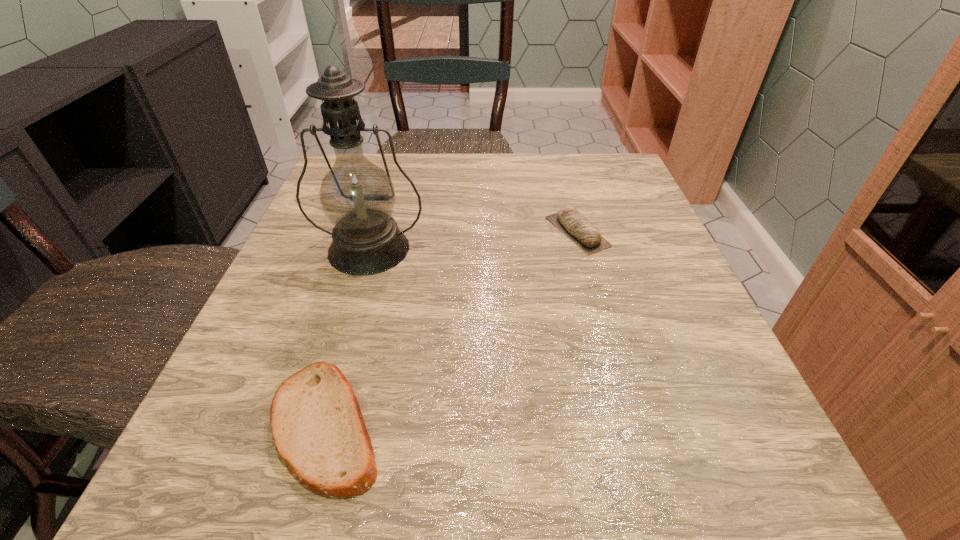
You are a GUI agent. You are given a task and a screenshot of the screen. Output one action in this format:
    pyautogui.click(x=<x>, y=<y>)
    Task: Click on the object that is the second closest to the oil lamp
    The height and width of the screenshot is (540, 960).
    Given the screenshot: What is the action you would take?
    pyautogui.click(x=575, y=226)

Locate an element on the screen. blank space that satisfies the following two spatial constraints: 1. on the back side of the nearest object; 2. on the left side of the rightmost object is located at coordinates (381, 232).

Find the location of a particular element. Image resolution: width=960 pixels, height=540 pixels. vacant space that satisfies the following two spatial constraints: 1. on the back side of the rightmost object; 2. on the right side of the tallest object is located at coordinates (374, 232).